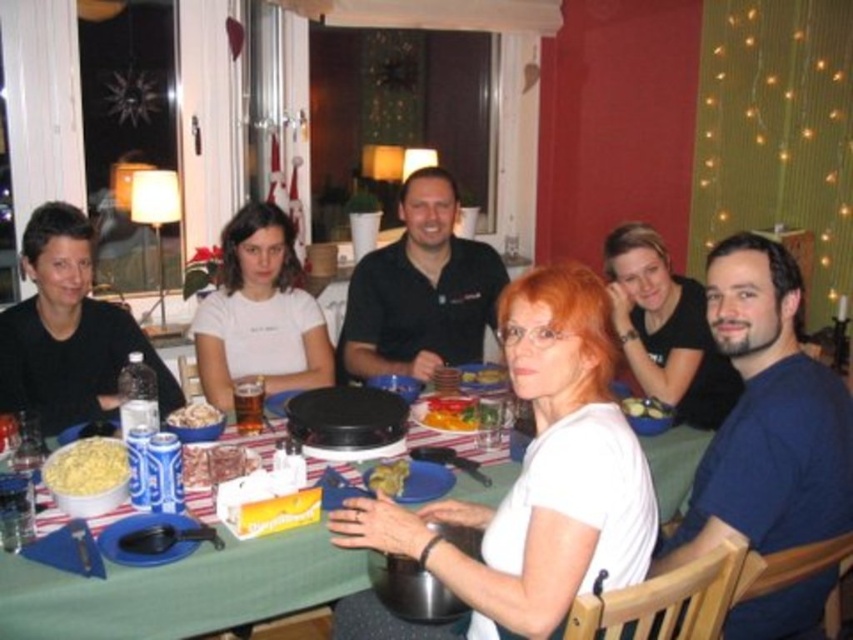
Is point (693, 522) closer to camera compared to point (91, 358)?

Yes, point (693, 522) is closer to viewer.

Identify the location of dark blue t-shirt at right. This screenshot has height=640, width=853. (766, 417).

In the scene shown: Does green fabric table at center have a greater width compared to smooth yellowish-green vegetables at center?

Indeed, green fabric table at center has a greater width compared to smooth yellowish-green vegetables at center.

Is point (33, 616) more distant than point (660, 417)?

No, it is not.

I want to click on green fabric table at center, so click(x=178, y=589).

Does dark blue t-shirt at right appear over matte black shirt at upper right?

No.

Is point (759, 477) positioned after point (637, 321)?

No.

Does point (711, 476) come closer to viewer compared to point (633, 227)?

That is True.

You are a GUI agent. You are given a task and a screenshot of the screen. Output one action in this format:
    pyautogui.click(x=<x>, y=<y>)
    Task: Click on the dark blue t-shirt at right
    
    Given the screenshot: What is the action you would take?
    pyautogui.click(x=766, y=417)